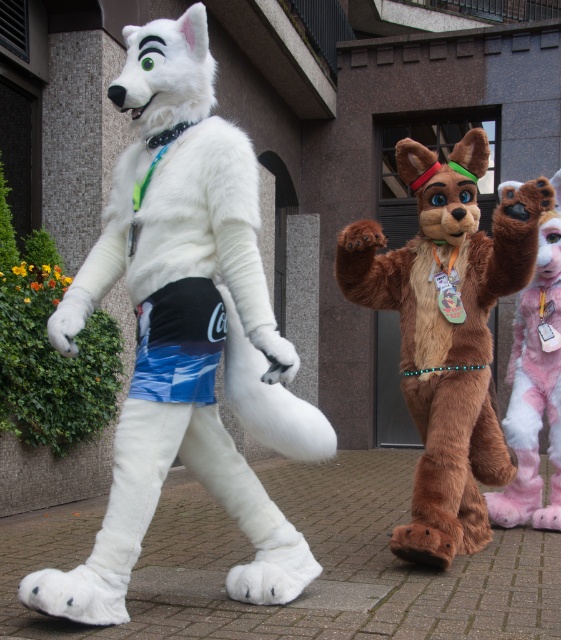
You are standing at the center of the image. Which direction should you turn to face the white fur mascot at left?

You should turn to your left to face the white fur mascot at left since it is positioned to the left of the center point.